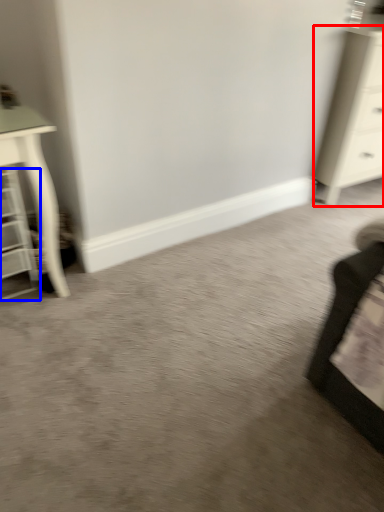
Question: Which object appears closest to the camera in this image, chest of drawers (highlighted by a red box) or shelf (highlighted by a blue box)?

Choices:
 (A) chest of drawers
 (B) shelf

Answer: (B)